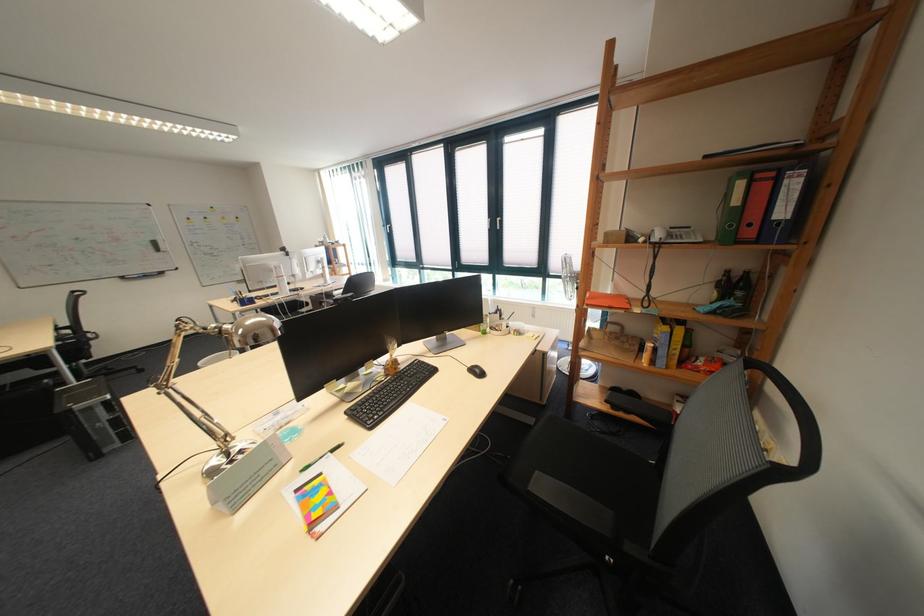
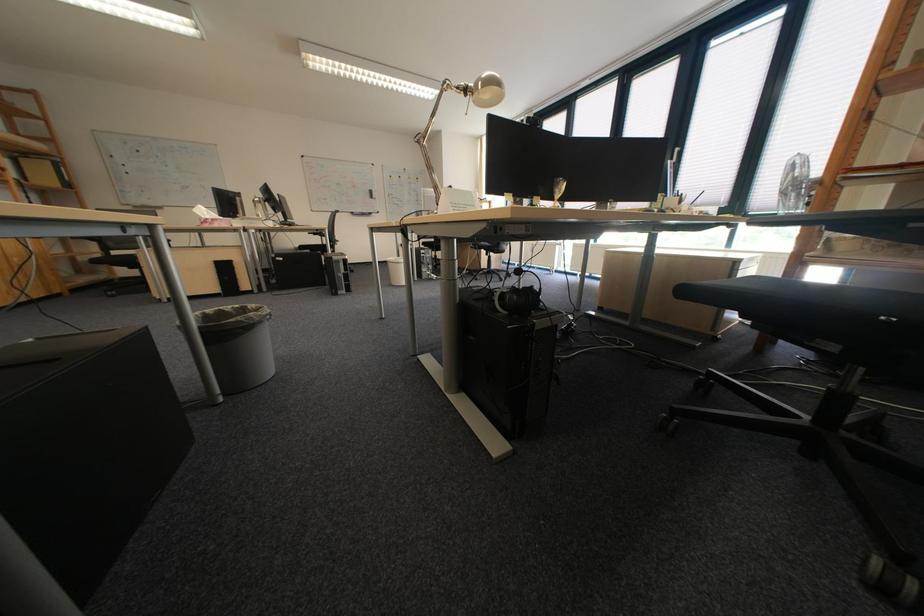
What movement of the cameraman would produce the second image?

The cameraman moved toward left, backward.